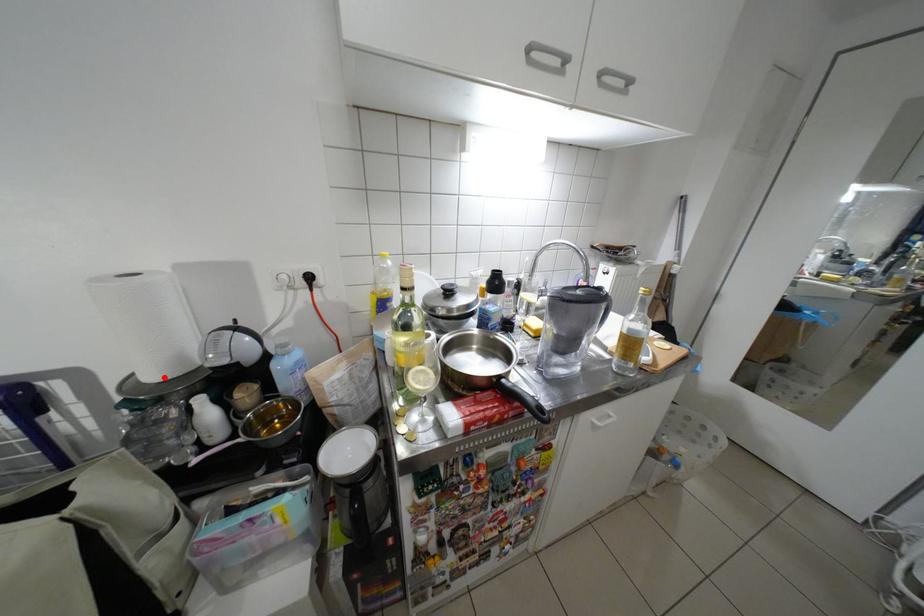
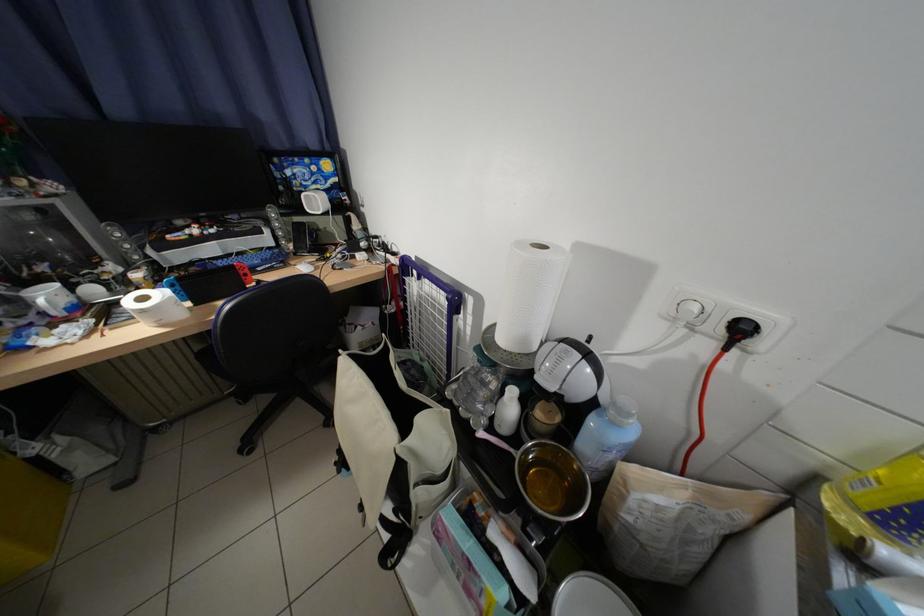
The point at the highlighted location is marked in the first image. Where is the corresponding point in the second image?

(514, 341)